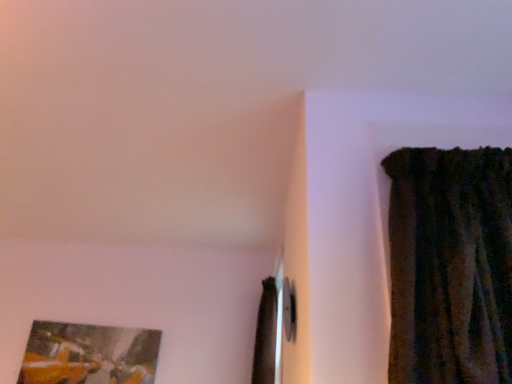
Question: In terms of width, does matte wooden picture frame at lower left look wider or thinner when compared to brown velvet curtain at center?

Choices:
 (A) wide
 (B) thin

Answer: (B)

Question: Is matte wooden picture frame at lower left to the left or to the right of brown velvet curtain at center in the image?

Choices:
 (A) left
 (B) right

Answer: (A)

Question: Which is correct: matte wooden picture frame at lower left is inside brown velvet curtain at center, or outside of it?

Choices:
 (A) inside
 (B) outside

Answer: (B)

Question: Looking at their shapes, would you say brown velvet curtain at center is wider or thinner than matte wooden picture frame at lower left?

Choices:
 (A) wide
 (B) thin

Answer: (A)

Question: Is brown velvet curtain at center situated inside matte wooden picture frame at lower left or outside?

Choices:
 (A) inside
 (B) outside

Answer: (B)

Question: Considering the relative positions of brown velvet curtain at center and matte wooden picture frame at lower left in the image provided, is brown velvet curtain at center to the left or to the right of matte wooden picture frame at lower left?

Choices:
 (A) right
 (B) left

Answer: (A)

Question: From a real-world perspective, is brown velvet curtain at center above or below matte wooden picture frame at lower left?

Choices:
 (A) above
 (B) below

Answer: (A)